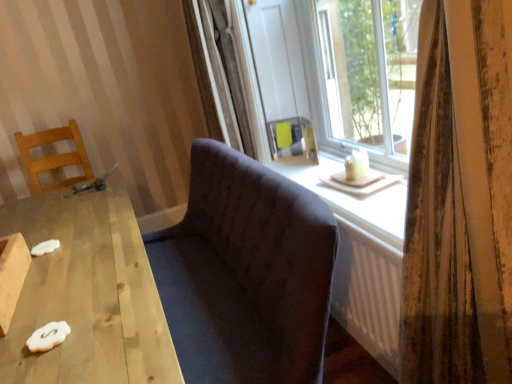
Question: Is dark fabric couch at center located within wooden chair at left?

Choices:
 (A) no
 (B) yes

Answer: (A)

Question: Does wooden chair at left have a greater width compared to dark fabric couch at center?

Choices:
 (A) no
 (B) yes

Answer: (A)

Question: Does wooden chair at left have a lesser width compared to dark fabric couch at center?

Choices:
 (A) no
 (B) yes

Answer: (B)

Question: Does wooden chair at left have a greater height compared to dark fabric couch at center?

Choices:
 (A) yes
 (B) no

Answer: (B)

Question: Can you confirm if wooden chair at left is smaller than dark fabric couch at center?

Choices:
 (A) yes
 (B) no

Answer: (A)

Question: Is wooden chair at left far away from dark fabric couch at center?

Choices:
 (A) no
 (B) yes

Answer: (B)

Question: Is striped fabric curtain at right positioned beyond the bounds of wooden table at lower left?

Choices:
 (A) no
 (B) yes

Answer: (B)

Question: Does striped fabric curtain at right lie in front of wooden table at lower left?

Choices:
 (A) yes
 (B) no

Answer: (A)

Question: From a real-world perspective, is striped fabric curtain at right physically above wooden table at lower left?

Choices:
 (A) no
 (B) yes

Answer: (B)

Question: Is striped fabric curtain at right oriented away from wooden table at lower left?

Choices:
 (A) yes
 (B) no

Answer: (B)

Question: Would you say striped fabric curtain at right is a long distance from wooden table at lower left?

Choices:
 (A) yes
 (B) no

Answer: (B)

Question: Considering the relative sizes of striped fabric curtain at right and wooden table at lower left in the image provided, is striped fabric curtain at right taller than wooden table at lower left?

Choices:
 (A) no
 (B) yes

Answer: (B)

Question: Considering the relative positions of matte glass window at center and wooden table at lower left in the image provided, is matte glass window at center to the right of wooden table at lower left from the viewer's perspective?

Choices:
 (A) no
 (B) yes

Answer: (B)